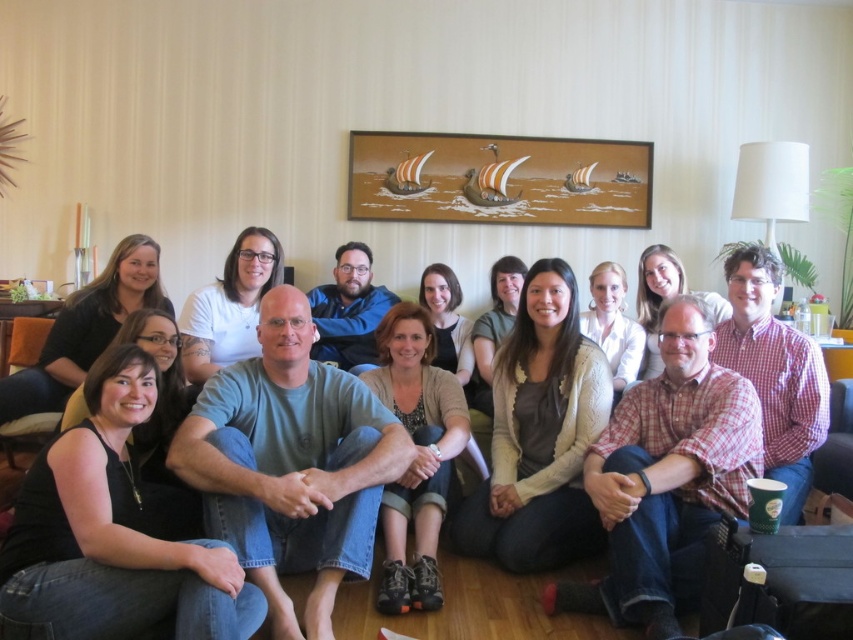
You are a photographer trying to capture a group photo of the people in the living room. You notice two individuals wearing a green cotton shirt at center and a matte gray shirt at center. Since you want to ensure everyone is visible in the photo, which person should you ask to move slightly forward to avoid being blocked by the other?

The green cotton shirt at center is much taller than the matte gray shirt at center, so you should ask the green cotton shirt at center to move slightly forward to avoid blocking the shorter matte gray shirt at center.

You are organizing a photo shoot and need to arrange two shirts, the green cotton shirt at center and the matte gray shirt at center, for a display. Based on their sizes, which shirt should you place on a smaller mannequin?

The green cotton shirt at center has a smaller size compared to matte gray shirt at center, so it should be placed on the smaller mannequin.

You are a photographer holding a camera. You want to take a photo of the green cotton shirt at center without moving the shirt. Can you do it from your current position?

The green cotton shirt at center and camera are 2.04 meters apart from each other, so yes, you can take the photo from your current position since the distance is sufficient.